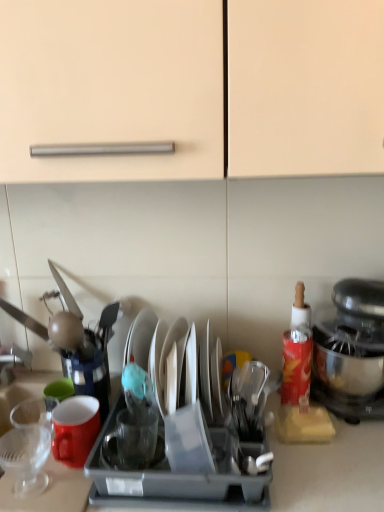
Question: From a real-world perspective, is matte ceramic mug at left physically located above or below red matte bottle at right?

Choices:
 (A) below
 (B) above

Answer: (A)

Question: Is matte ceramic mug at left spatially inside red matte bottle at right, or outside of it?

Choices:
 (A) outside
 (B) inside

Answer: (A)

Question: Which object is the farthest from the red matte bottle at right?

Choices:
 (A) transparent glass cup at left, placed as the 1th tableware when sorted from left to right
 (B) transparent glass cup at center, marked as the second tableware in a right-to-left arrangement
 (C) shiny silver plate at center, which appears as the 1th tableware when viewed from the right
 (D) matte ceramic mug at left
 (E) metallic silver stand mixer at right

Answer: (A)

Question: Which object is positioned closest to the transparent glass cup at center, marked as the second tableware in a right-to-left arrangement?

Choices:
 (A) metallic silver stand mixer at right
 (B) matte ceramic mug at left
 (C) red matte bottle at right
 (D) transparent glass cup at left, marked as the third tableware in a right-to-left arrangement
 (E) shiny silver plate at center, which appears as the 1th tableware when viewed from the right

Answer: (B)